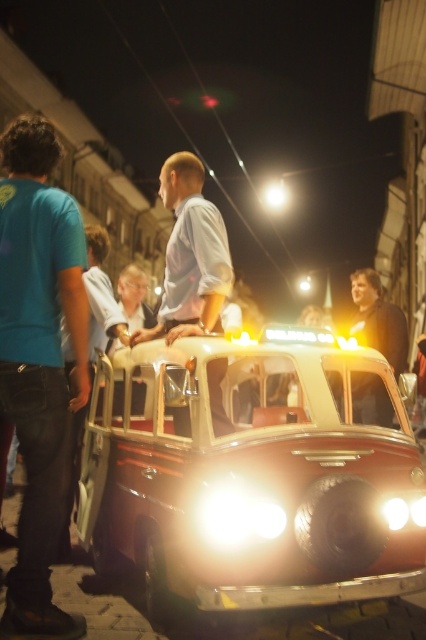
Does bright white plastic headlight at center have a larger size compared to matte white shirt at center?

No, bright white plastic headlight at center is not bigger than matte white shirt at center.

Based on the photo, is bright white plastic headlight at center below matte white shirt at center?

Yes.

Locate an element on the screen. The image size is (426, 640). bright white plastic headlight at center is located at coordinates (236, 513).

Which is behind, point (101, 280) or point (388, 522)?

The point (101, 280) is more distant.

Between matte white shirt at center and glossy plastic headlight at lower center, which one has more height?

With more height is matte white shirt at center.

Between point (103, 289) and point (394, 509), which one is positioned in front?

Point (394, 509) is in front.

Locate an element on the screen. The width and height of the screenshot is (426, 640). matte white shirt at center is located at coordinates (100, 296).

Can you confirm if teal t-shirt at left is bigger than matte white shirt at center?

Yes.

Can you confirm if teal t-shirt at left is positioned to the left of matte white shirt at center?

Incorrect, teal t-shirt at left is not on the left side of matte white shirt at center.

Find the location of a particular element. The height and width of the screenshot is (640, 426). teal t-shirt at left is located at coordinates (39, 362).